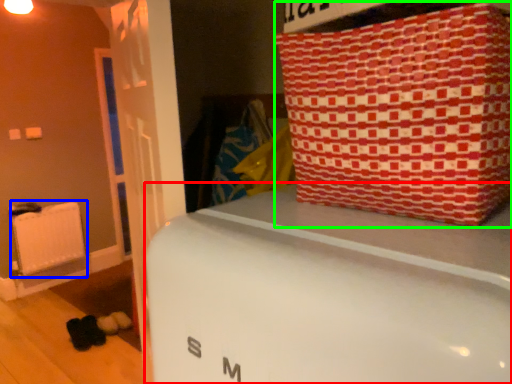
Question: Which object is the farthest from furniture (highlighted by a red box)? Choose among these: radiator (highlighted by a blue box) or package (highlighted by a green box).

Choices:
 (A) radiator
 (B) package

Answer: (A)